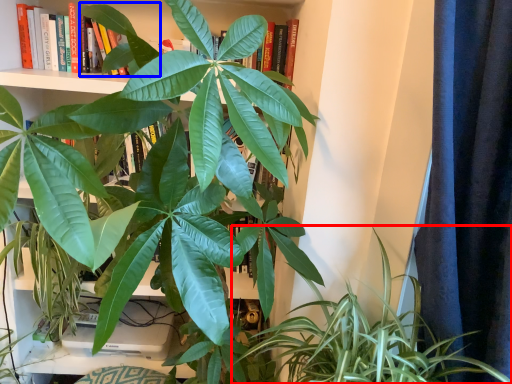
Question: Which point is further to the camera, houseplant (highlighted by a red box) or leaf (highlighted by a blue box)?

Choices:
 (A) houseplant
 (B) leaf

Answer: (B)